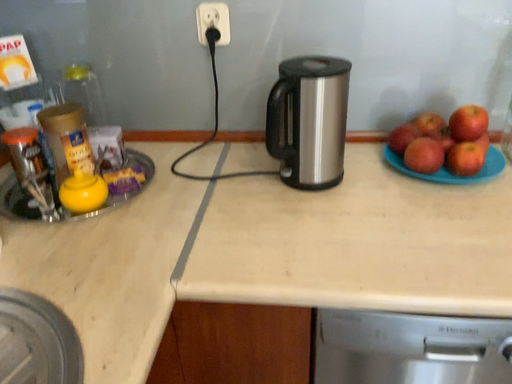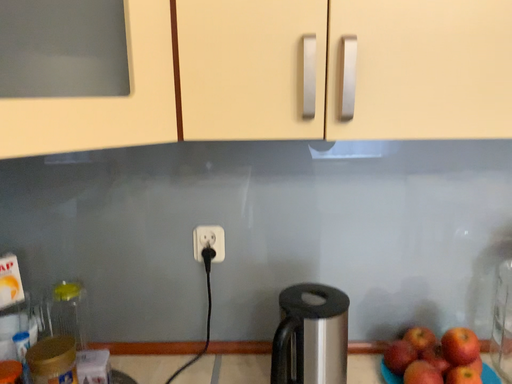
Question: How did the camera likely rotate when shooting the video?

Choices:
 (A) rotated downward
 (B) rotated upward

Answer: (B)